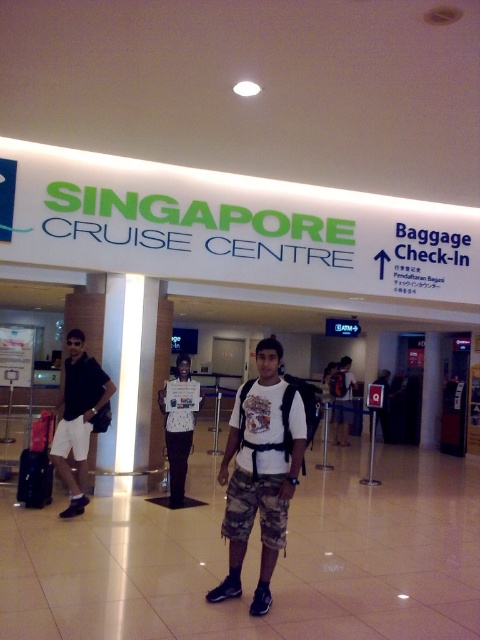
Question: Can you confirm if camo shorts at center is thinner than white matte shirt at center?

Choices:
 (A) no
 (B) yes

Answer: (A)

Question: Which of the following is the closest to the observer?

Choices:
 (A) (236, 449)
 (B) (342, 384)
 (C) (37, 486)
 (D) (189, 362)

Answer: (A)

Question: Is matte black shirt at left to the right of white matte shirt at center from the viewer's perspective?

Choices:
 (A) no
 (B) yes

Answer: (A)

Question: Does matte black suitcase at left appear on the right side of white t-shirt at center?

Choices:
 (A) yes
 (B) no

Answer: (B)

Question: Which is farther from the white matte shirt at center?

Choices:
 (A) white t-shirt at center
 (B) matte black shirt at left
 (C) camo shorts at center

Answer: (A)

Question: Which point is closer to the camera?

Choices:
 (A) matte black shirt at left
 (B) white matte shirt at center

Answer: (A)